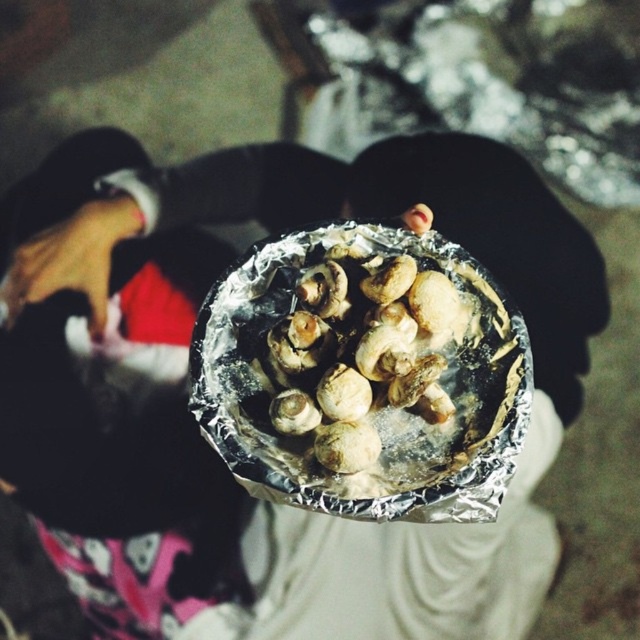
You are a GUI agent. You are given a task and a screenshot of the screen. Output one action in this format:
    pyautogui.click(x=<x>, y=<y>)
    Task: Click on the white matte mushrooms at center
    The height and width of the screenshot is (640, 640).
    Given the screenshot: What is the action you would take?
    pyautogui.click(x=372, y=368)